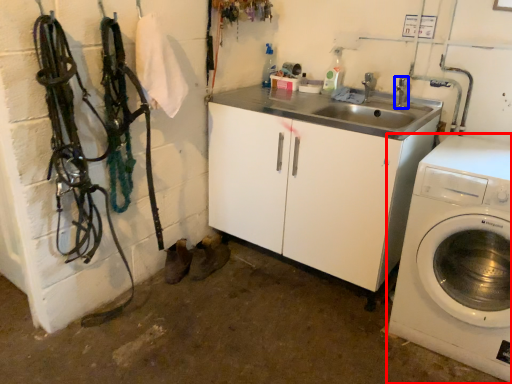
Question: Which object appears farthest to the camera in this image, washing machine (highlighted by a red box) or faucet (highlighted by a blue box)?

Choices:
 (A) washing machine
 (B) faucet

Answer: (B)